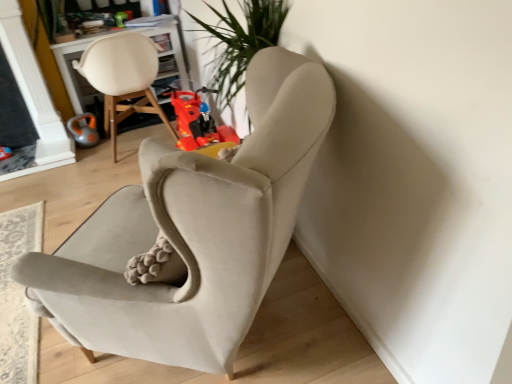
Find the location of a particular element. vacant space underneath orange rubber toy at left, which is the second toy from right to left (from a real-world perspective) is located at coordinates (96, 142).